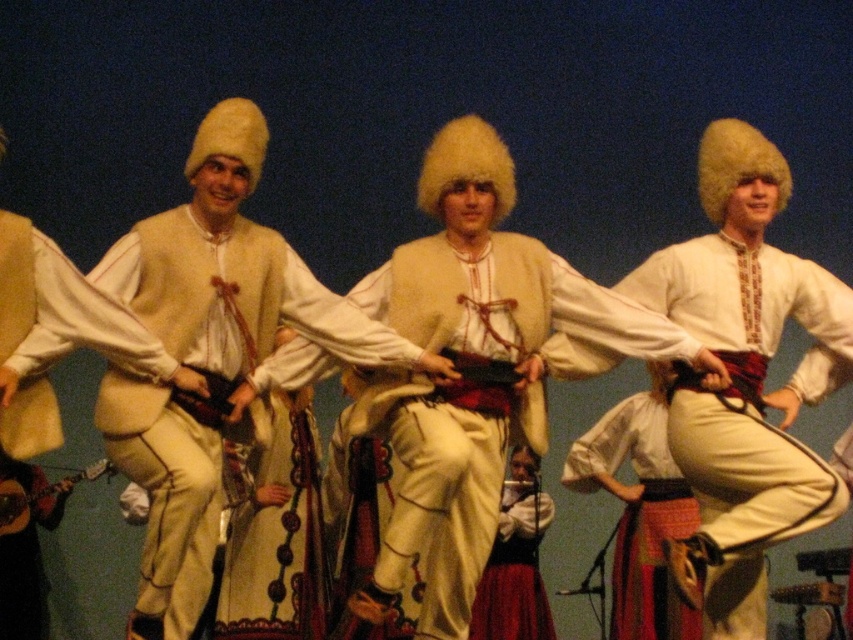
Which is behind, point (277, 307) or point (624, 536)?

The point (624, 536) is more distant.

Is white woolen hat at center wider than white cotton skirt at center?

Yes, white woolen hat at center is wider than white cotton skirt at center.

Between point (166, 307) and point (624, 627), which one is positioned behind?

Positioned behind is point (624, 627).

Find the location of a particular element. This screenshot has height=640, width=853. white woolen hat at center is located at coordinates (235, 268).

Does point (456, 305) come in front of point (221, 365)?

No, it is not.

Which is more to the right, white woolen vest at center or white woolen hat at center?

From the viewer's perspective, white woolen vest at center appears more on the right side.

The image size is (853, 640). Find the location of `white woolen vest at center`. white woolen vest at center is located at coordinates (474, 358).

What are the coordinates of `white woolen vest at center` in the screenshot? It's located at (474, 358).

Does white woolen vest at center appear on the right side of white fur hat at center?

In fact, white woolen vest at center is to the left of white fur hat at center.

Between white woolen vest at center and white fur hat at center, which one appears on the right side from the viewer's perspective?

white fur hat at center

Which is behind, point (445, 403) or point (828, 499)?

Point (445, 403)

The width and height of the screenshot is (853, 640). What are the coordinates of `white woolen vest at center` in the screenshot? It's located at (474, 358).